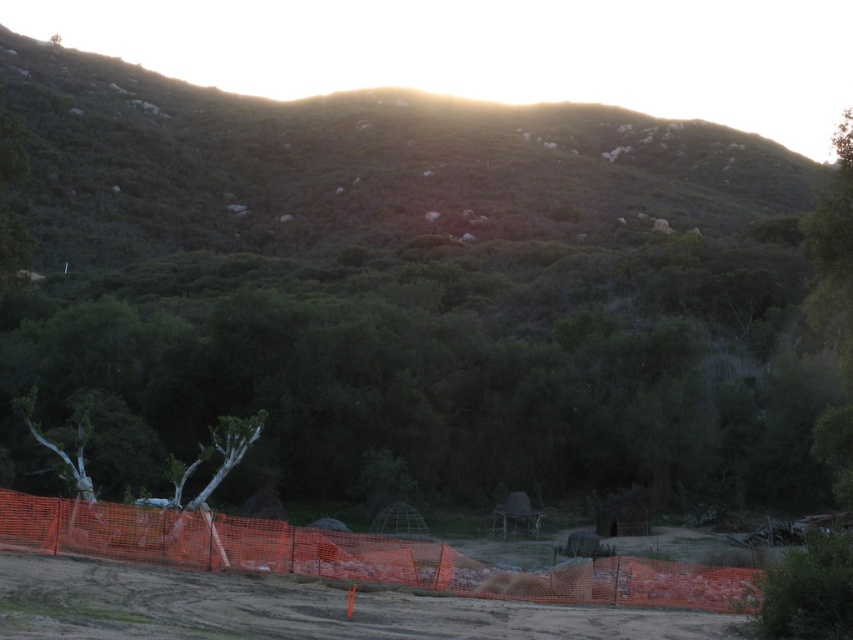
Question: Can you confirm if dirt track at lower center is thinner than orange mesh fence at lower center?

Choices:
 (A) yes
 (B) no

Answer: (A)

Question: Does green leafy tree at center lie in front of green leafy hillside at upper center?

Choices:
 (A) no
 (B) yes

Answer: (B)

Question: Among these objects, which one is farthest from the camera?

Choices:
 (A) green leafy hillside at upper center
 (B) orange mesh fence at lower center

Answer: (A)

Question: Considering the real-world distances, which object is farthest from the dirt track at lower center?

Choices:
 (A) green leafy tree at center
 (B) orange mesh fence at lower center

Answer: (A)

Question: Considering the relative positions of green leafy tree at center and green leafy hillside at upper center in the image provided, where is green leafy tree at center located with respect to green leafy hillside at upper center?

Choices:
 (A) right
 (B) left

Answer: (A)

Question: Which object appears closest to the camera in this image?

Choices:
 (A) orange mesh fence at lower center
 (B) green leafy hillside at upper center
 (C) dirt track at lower center

Answer: (C)